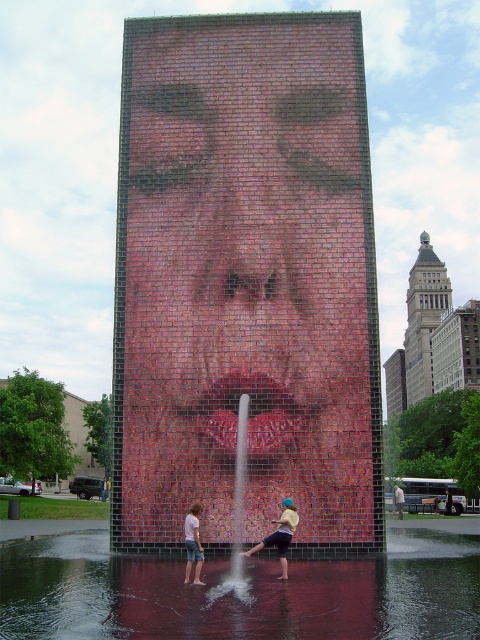
Question: Is denim shorts at lower center further to camera compared to gray concrete man at center?

Choices:
 (A) yes
 (B) no

Answer: (B)

Question: Among these objects, which one is farthest from the camera?

Choices:
 (A) denim shorts at lower center
 (B) yellow cotton shirt at center

Answer: (B)

Question: Which point is closer to the camera?

Choices:
 (A) brick mosaic face at center
 (B) clear water at center

Answer: (B)

Question: Which of these objects is positioned closest to the gray concrete man at center?

Choices:
 (A) yellow cotton shirt at center
 (B) denim shorts at lower center

Answer: (A)

Question: From the image, what is the correct spatial relationship of clear water at center in relation to denim shorts at lower center?

Choices:
 (A) right
 (B) left

Answer: (A)

Question: Is clear water at center below gray concrete man at center?

Choices:
 (A) yes
 (B) no

Answer: (B)